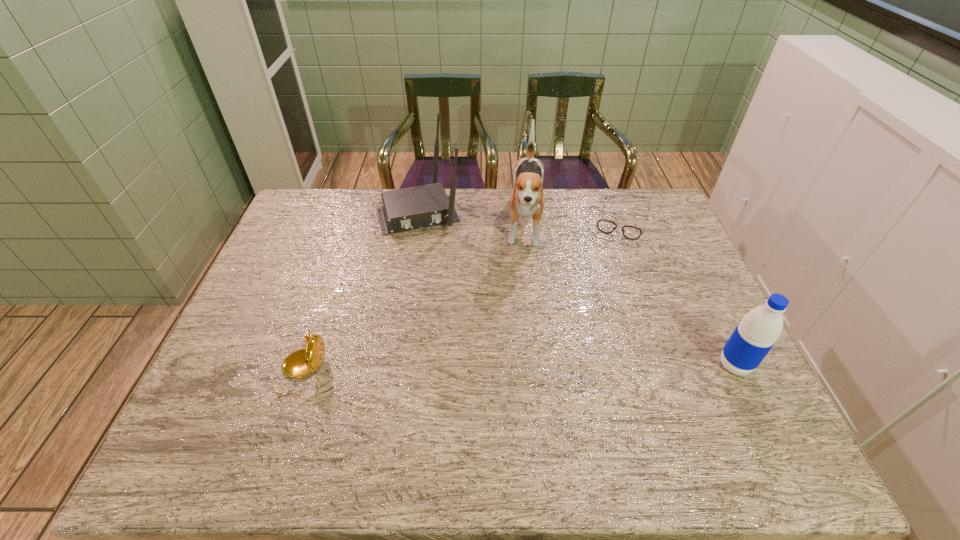
Locate an element on the screen. This screenshot has height=540, width=960. blank region between the router and the third object from right to left is located at coordinates (472, 220).

I want to click on free space between the shortest object and the router, so click(x=520, y=217).

Find the location of a particular element. This screenshot has height=540, width=960. empty space that is in between the third object from right to left and the pocket watch is located at coordinates (415, 301).

Where is `object that stands as the second closest to the third object from left to right`? The width and height of the screenshot is (960, 540). object that stands as the second closest to the third object from left to right is located at coordinates click(x=605, y=226).

The width and height of the screenshot is (960, 540). In order to click on the fourth closest object to the rightmost object in this screenshot , I will do `click(300, 363)`.

Identify the location of free space that satisfies the following two spatial constraints: 1. on the front side of the fourth object from left to right; 2. on the left side of the rightmost object. This screenshot has height=540, width=960. (675, 365).